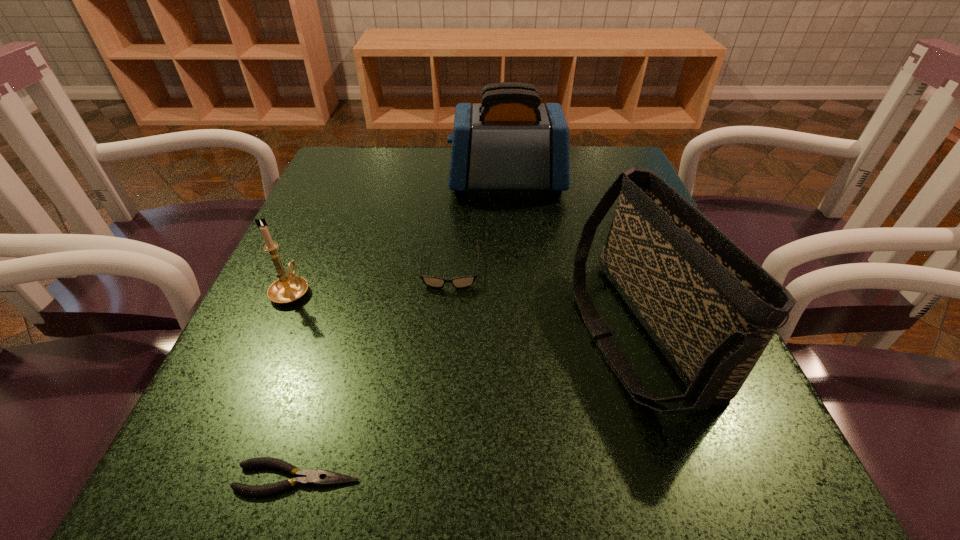
You are a GUI agent. You are given a task and a screenshot of the screen. Output one action in this format:
    pyautogui.click(x=<x>, y=<y>)
    Task: Click on the free location at the near right corner of the desktop
    Image resolution: width=960 pixels, height=540 pixels.
    Given the screenshot: What is the action you would take?
    pyautogui.click(x=707, y=510)

Where is `unoccupied position between the candle holder and the shortest object`? The width and height of the screenshot is (960, 540). unoccupied position between the candle holder and the shortest object is located at coordinates [295, 384].

At what (x,y) coordinates should I click in order to perform the action: click on unoccupied area between the second shortest object and the farthest object. Please return your answer as a coordinate pair (x, y). Looking at the image, I should click on (478, 226).

Image resolution: width=960 pixels, height=540 pixels. In order to click on free point between the shortest object and the candle holder in this screenshot , I will do `click(295, 384)`.

Find the location of a particular element. free space between the handbag and the fourth tallest object is located at coordinates (545, 301).

Find the location of a particular element. This screenshot has width=960, height=540. empty space between the second shortest object and the farthest object is located at coordinates (478, 226).

Locate an element on the screen. Image resolution: width=960 pixels, height=540 pixels. free space between the sunglasses and the shortest object is located at coordinates (374, 374).

Find the location of a particular element. empty space that is in between the fourth object from right to left and the candle holder is located at coordinates (295, 384).

Find the location of a particular element. empty location between the leftmost object and the handbag is located at coordinates (466, 312).

Locate an element on the screen. Image resolution: width=960 pixels, height=540 pixels. free point between the third shortest object and the handbag is located at coordinates (x=466, y=312).